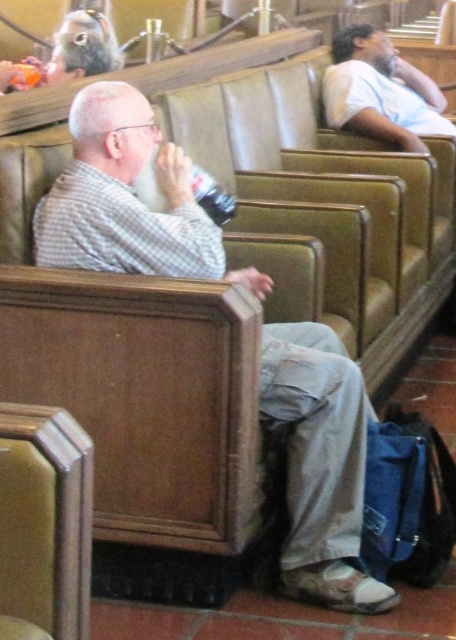
Is matte plaid shirt at center to the left of matte black hair at upper left from the viewer's perspective?

No, matte plaid shirt at center is not to the left of matte black hair at upper left.

Is matte plaid shirt at center above matte black hair at upper left?

No.

Identify the location of matte plaid shirt at center. (128, 198).

Does matte plaid shirt at center have a lesser width compared to light brown leather shirt at upper right?

No.

Can you confirm if matte plaid shirt at center is positioned to the left of light brown leather shirt at upper right?

Indeed, matte plaid shirt at center is positioned on the left side of light brown leather shirt at upper right.

Which is in front, point (346, 432) or point (387, 90)?

Point (346, 432) is more forward.

Where is `matte plaid shirt at center`? The height and width of the screenshot is (640, 456). matte plaid shirt at center is located at coordinates (128, 198).

Which is more to the left, matte plaid shirt at center or clear plastic bottle at center?

clear plastic bottle at center is more to the left.

Is matte plaid shirt at center below clear plastic bottle at center?

Correct, matte plaid shirt at center is located below clear plastic bottle at center.

Who is more distant from viewer, (374, 586) or (221, 221)?

Positioned behind is point (221, 221).

Where is `matte plaid shirt at center`? matte plaid shirt at center is located at coordinates (128, 198).